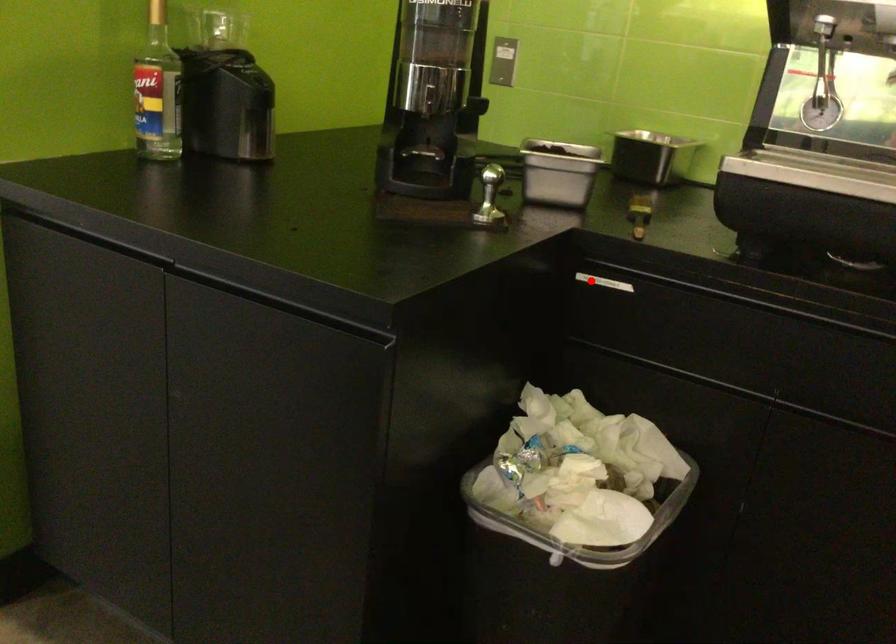
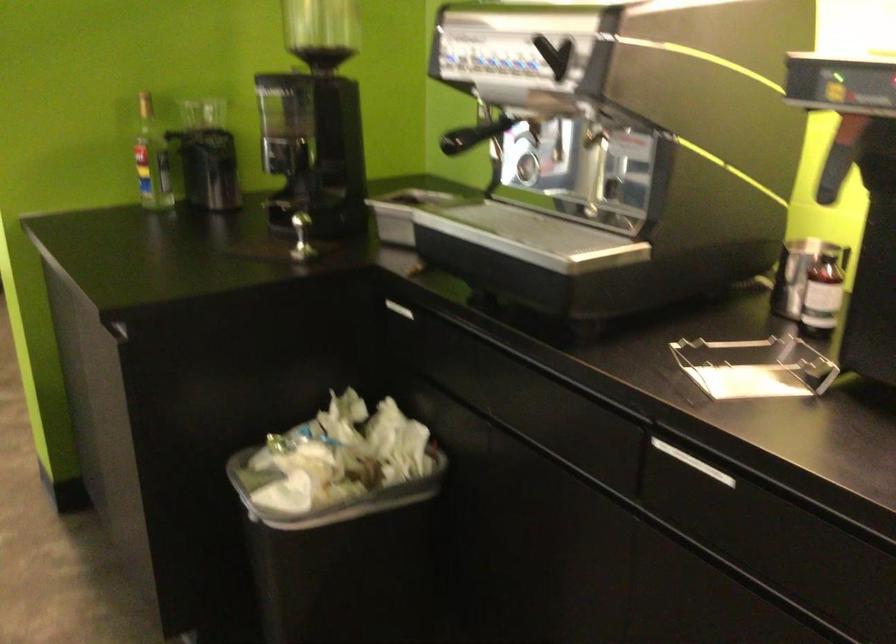
Question: I am providing you with two images of the same scene from different viewpoints. In image1, a red point is highlighted. Considering the same 3D point in image2, which of the following is correct?

Choices:
 (A) It is closer
 (B) It is farther

Answer: (B)